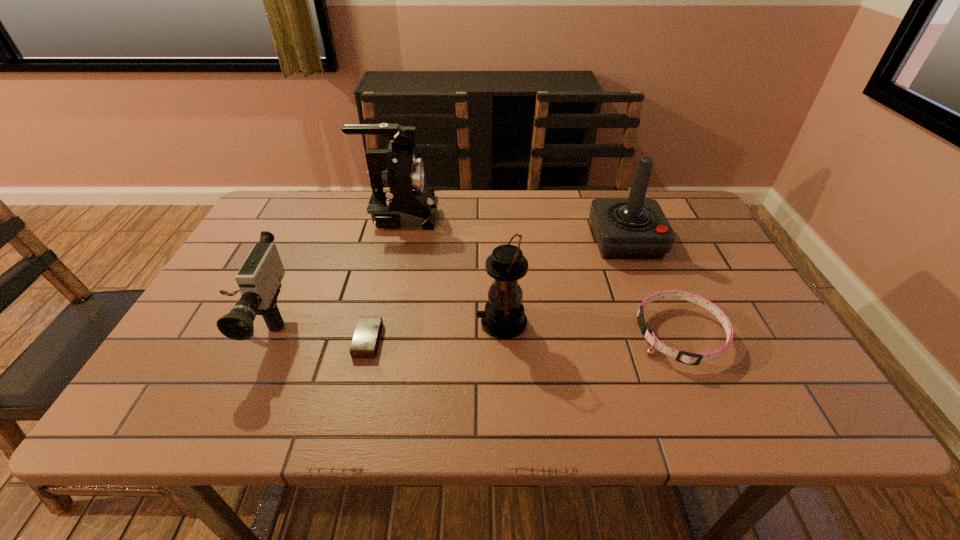
This screenshot has width=960, height=540. I want to click on vacant area between the second shortest object and the left camcorder, so click(467, 331).

Where is `vacant area between the dog collar and the alarm clock`? vacant area between the dog collar and the alarm clock is located at coordinates (524, 338).

Where is `free area in between the lantern and the farther camcorder`? The image size is (960, 540). free area in between the lantern and the farther camcorder is located at coordinates (451, 269).

I want to click on free spot between the second shortest object and the joystick, so (653, 288).

This screenshot has height=540, width=960. I want to click on vacant space that's between the leftmost object and the dog collar, so click(x=467, y=331).

The width and height of the screenshot is (960, 540). What are the coordinates of `vacant space in between the dog collar and the right camcorder` in the screenshot? It's located at (540, 276).

Where is `free space between the shortest object and the nearer camcorder`? The image size is (960, 540). free space between the shortest object and the nearer camcorder is located at coordinates (310, 334).

Where is `free space between the right camcorder and the alarm clock`? The height and width of the screenshot is (540, 960). free space between the right camcorder and the alarm clock is located at coordinates (384, 279).

Find the location of a particular element. The width and height of the screenshot is (960, 540). free space between the lantern and the alarm clock is located at coordinates (435, 332).

In order to click on object that is the fourth closest to the shortest object in this screenshot , I will do `click(695, 358)`.